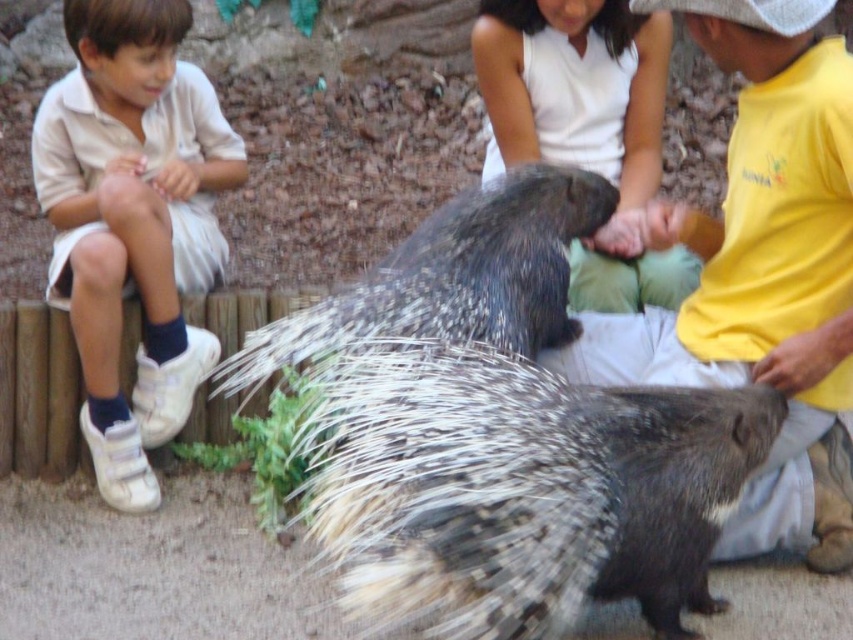
The image size is (853, 640). Describe the element at coordinates (502, 433) in the screenshot. I see `spiky fur hedgehog at center` at that location.

This screenshot has height=640, width=853. In order to click on spiky fur hedgehog at center in this screenshot , I will do `click(502, 433)`.

The height and width of the screenshot is (640, 853). I want to click on spiky fur hedgehog at center, so click(502, 433).

Is white cotton shirt at left thinner than white cotton shirt at center?

Indeed, white cotton shirt at left has a lesser width compared to white cotton shirt at center.

Is point (165, 12) less distant than point (659, 300)?

Yes.

Where is `white cotton shirt at left`? This screenshot has height=640, width=853. white cotton shirt at left is located at coordinates (132, 221).

Is point (796, 372) positioned before point (614, 72)?

Yes.

Between point (737, 536) and point (635, 140), which one is positioned in front?

Point (737, 536) is in front.

I want to click on yellow cotton shirt at center, so click(756, 240).